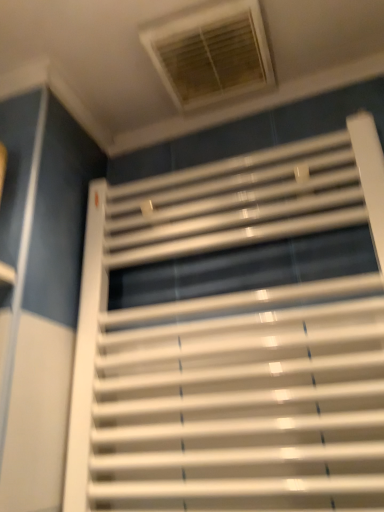
Question: Considering the relative positions of white plastic window at upper center and white glossy window blind at center in the image provided, is white plastic window at upper center to the left or to the right of white glossy window blind at center?

Choices:
 (A) right
 (B) left

Answer: (B)

Question: Looking at their shapes, would you say white plastic window at upper center is wider or thinner than white glossy window blind at center?

Choices:
 (A) wide
 (B) thin

Answer: (A)

Question: Is white plastic window at upper center in front of or behind white glossy window blind at center in the image?

Choices:
 (A) front
 (B) behind

Answer: (B)

Question: From the image's perspective, is white glossy window blind at center above or below white plastic window at upper center?

Choices:
 (A) above
 (B) below

Answer: (B)

Question: Does point (168, 396) appear closer or farther from the camera than point (193, 25)?

Choices:
 (A) farther
 (B) closer

Answer: (A)

Question: Is white glossy window blind at center wider or thinner than white plastic window at upper center?

Choices:
 (A) thin
 (B) wide

Answer: (A)

Question: Is white glossy window blind at center to the left or to the right of white plastic window at upper center in the image?

Choices:
 (A) right
 (B) left

Answer: (A)